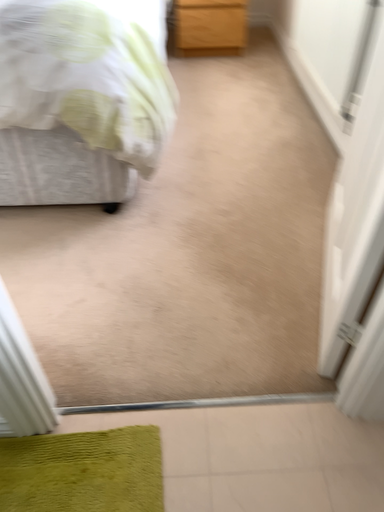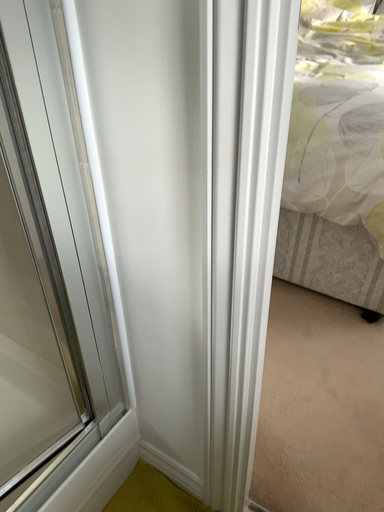
Question: How did the camera likely rotate when shooting the video?

Choices:
 (A) rotated downward
 (B) rotated upward

Answer: (B)